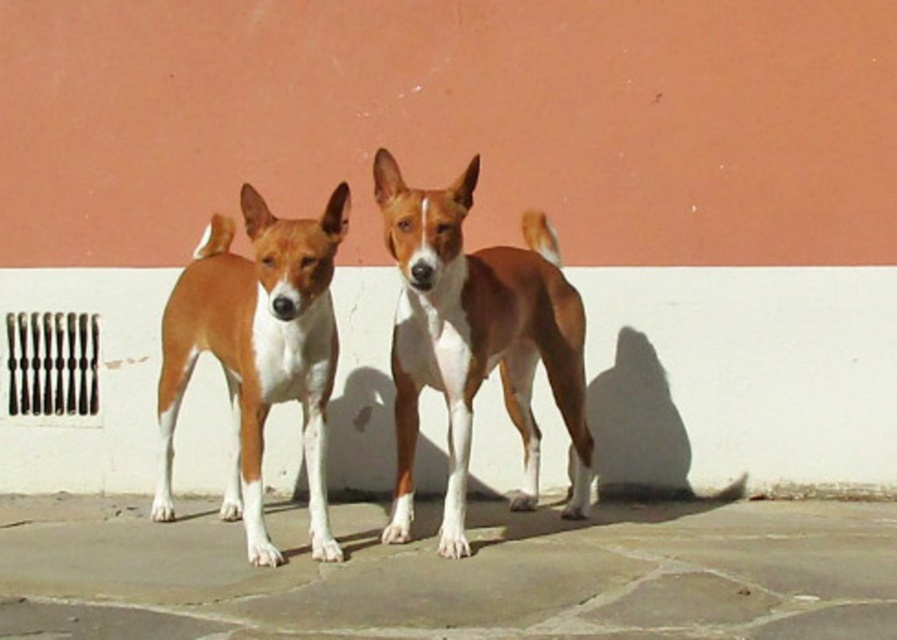
Does gray stone pavement at center appear on the left side of brown and white fur dog at center?

In fact, gray stone pavement at center is to the right of brown and white fur dog at center.

Can you confirm if gray stone pavement at center is smaller than brown and white fur dog at center?

Yes.

Does point (421, 628) come farther from viewer compared to point (176, 346)?

No, it is not.

Find the location of a particular element. The height and width of the screenshot is (640, 897). gray stone pavement at center is located at coordinates (453, 573).

Does gray stone pavement at center have a lesser width compared to brown furry dog at center?

No.

Is gray stone pavement at center below brown furry dog at center?

Yes.

Which is in front, point (48, 618) or point (401, 337)?

Point (48, 618) is in front.

At what (x,y) coordinates should I click in order to perform the action: click on gray stone pavement at center. Please return your answer as a coordinate pair (x, y). The width and height of the screenshot is (897, 640). Looking at the image, I should click on (453, 573).

Between brown furry dog at center and brown and white fur dog at center, which one has more height?

brown furry dog at center is taller.

Which is above, brown furry dog at center or brown and white fur dog at center?

brown furry dog at center

Is point (527, 266) positioned after point (162, 468)?

That is False.

Identify the location of brown furry dog at center. (477, 340).